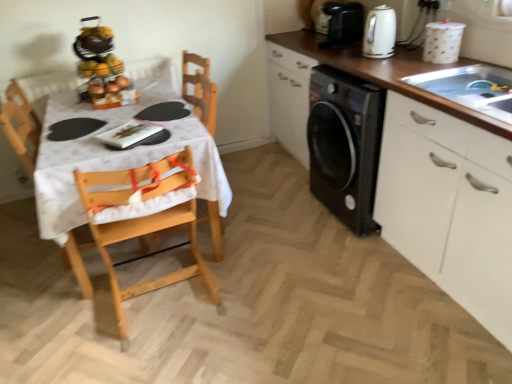
I want to click on vacant space to the right of white fabric tablecloth at left, so click(x=278, y=228).